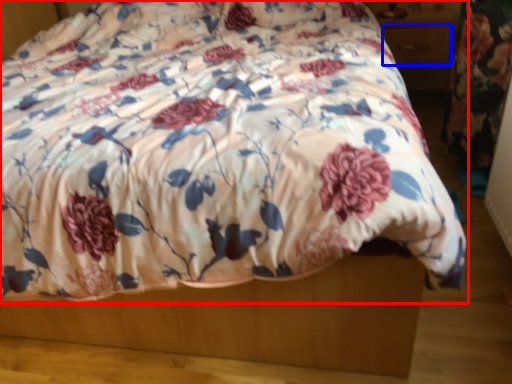
Question: Which of the following is the closest to the observer, bed (highlighted by a red box) or drawer (highlighted by a blue box)?

Choices:
 (A) bed
 (B) drawer

Answer: (A)